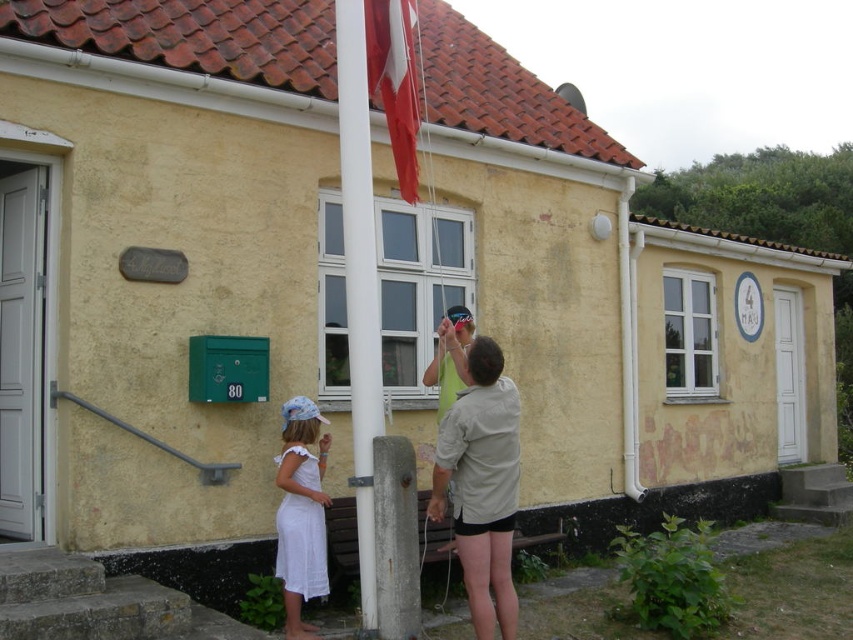
Which is behind, point (459, 424) or point (463, 342)?

Positioned behind is point (463, 342).

Can you confirm if light beige shirt at center is shorter than green fabric shirt at center?

Incorrect, light beige shirt at center's height does not fall short of green fabric shirt at center's.

Identify the location of light beige shirt at center. The height and width of the screenshot is (640, 853). (482, 484).

Can you confirm if light beige shirt at center is smaller than white cotton dress at lower left?

Actually, light beige shirt at center might be larger than white cotton dress at lower left.

Is light beige shirt at center wider than white cotton dress at lower left?

Indeed, light beige shirt at center has a greater width compared to white cotton dress at lower left.

Who is more distant from viewer, (x=483, y=582) or (x=322, y=552)?

Point (x=322, y=552)

The height and width of the screenshot is (640, 853). Find the location of `light beige shirt at center`. light beige shirt at center is located at coordinates (482, 484).

Is light beige shirt at center to the left of red fabric flag at upper center from the viewer's perspective?

No, light beige shirt at center is not to the left of red fabric flag at upper center.

Between light beige shirt at center and red fabric flag at upper center, which one appears on the left side from the viewer's perspective?

red fabric flag at upper center is more to the left.

I want to click on light beige shirt at center, so click(x=482, y=484).

This screenshot has height=640, width=853. Find the location of `light beige shirt at center`. light beige shirt at center is located at coordinates (482, 484).